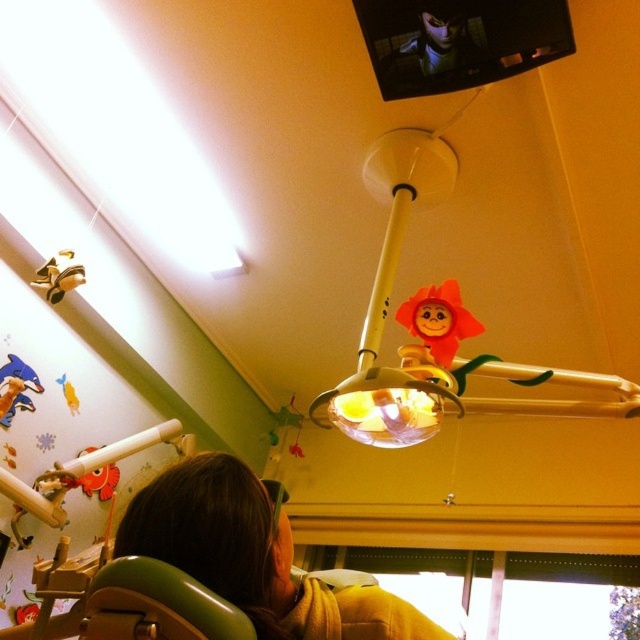
Does green plastic chair at lower left appear on the right side of matte plastic doll at center?

Incorrect, green plastic chair at lower left is not on the right side of matte plastic doll at center.

Does green plastic chair at lower left appear under matte plastic doll at center?

Indeed, green plastic chair at lower left is positioned under matte plastic doll at center.

Does point (100, 576) come closer to viewer compared to point (452, 308)?

Yes, point (100, 576) is in front of point (452, 308).

Find the location of a particular element. green plastic chair at lower left is located at coordinates (156, 605).

Is brown fabric at lower center thinner than metallic ring at upper center?

In fact, brown fabric at lower center might be wider than metallic ring at upper center.

Between brown fabric at lower center and metallic ring at upper center, which one appears on the right side from the viewer's perspective?

Positioned to the right is brown fabric at lower center.

Between point (276, 572) and point (81, 269), which one is positioned in front?

Point (276, 572)

Find the location of `brown fabric at lower center`. brown fabric at lower center is located at coordinates point(257,556).

Is point (154, 576) positioned behind point (68, 289)?

No, it is in front of (68, 289).

From the picture: Between green plastic chair at lower left and metallic ring at upper center, which one appears on the left side from the viewer's perspective?

Positioned to the left is metallic ring at upper center.

Is point (188, 580) positioned in front of point (72, 280)?

Yes, it is in front of point (72, 280).

The width and height of the screenshot is (640, 640). Identify the location of green plastic chair at lower left. (156, 605).